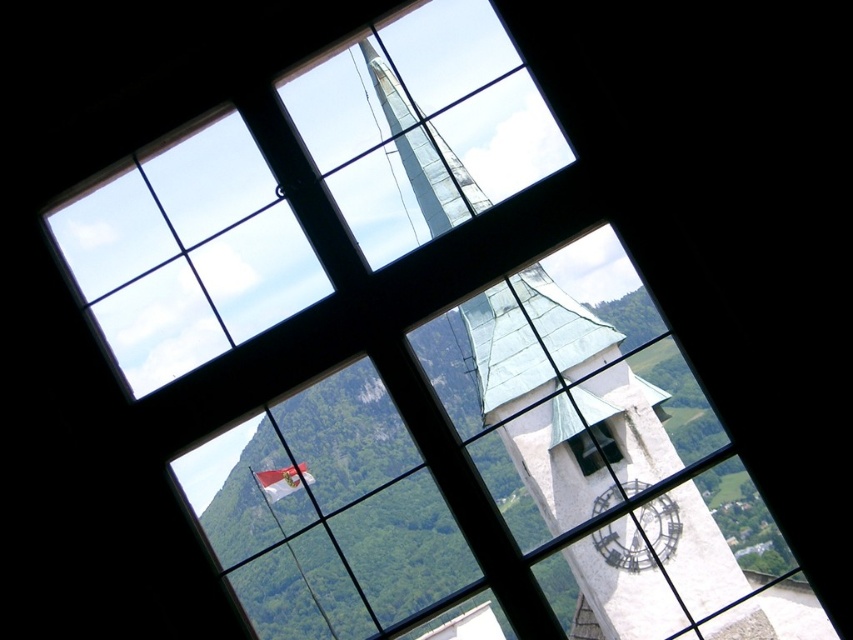
What do you see at coordinates (561, 394) in the screenshot? I see `white stone clock tower at center` at bounding box center [561, 394].

Who is more forward, (540, 320) or (610, 499)?

Positioned in front is point (610, 499).

Find the location of a particular element. The image size is (853, 640). white stone clock tower at center is located at coordinates (561, 394).

This screenshot has height=640, width=853. I want to click on white stone clock tower at center, so click(x=561, y=394).

Does point (436, 177) come closer to viewer compared to point (601, 422)?

No, (436, 177) is further to viewer.

Is white stone clock tower at center wider than transparent glass clock at center?

Indeed, white stone clock tower at center has a greater width compared to transparent glass clock at center.

Is point (538, 285) positioned before point (601, 420)?

No.

Where is `white stone clock tower at center`? Image resolution: width=853 pixels, height=640 pixels. white stone clock tower at center is located at coordinates (561, 394).

Looking at this image, which of these two, metallic clock face at lower right or transparent glass clock at center, stands shorter?

transparent glass clock at center

Is metallic clock face at lower right further to the viewer compared to transparent glass clock at center?

No, it is not.

Based on the photo, who is more distant from viewer, (643, 545) or (596, 424)?

The point (596, 424) is more distant.

Where is `metallic clock face at lower right`? metallic clock face at lower right is located at coordinates (640, 536).